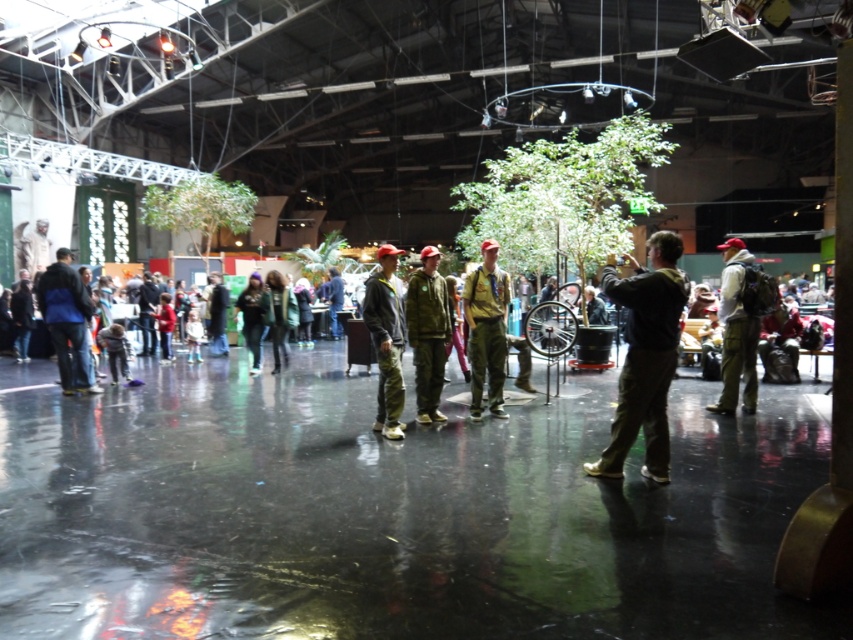
Question: Can you confirm if matte khaki pants at right is positioned to the right of matte green uniform at center?

Choices:
 (A) no
 (B) yes

Answer: (B)

Question: Which object is farther from the camera taking this photo?

Choices:
 (A) camouflage fabric jacket at center
 (B) dark green uniform at center
 (C) matte green uniform at center
 (D) blue jacket at left

Answer: (D)

Question: Observing the image, what is the correct spatial positioning of camouflage fabric jacket at center in reference to camo pants at center?

Choices:
 (A) left
 (B) right

Answer: (B)

Question: Does matte green uniform at center appear on the right side of camo pants at center?

Choices:
 (A) no
 (B) yes

Answer: (B)

Question: Which point appears closest to the camera in this image?

Choices:
 (A) (416, 337)
 (B) (49, 324)
 (C) (676, 298)
 (D) (494, 278)

Answer: (C)

Question: Estimate the real-world distances between objects in this image. Which object is closer to the dark green uniform at center?

Choices:
 (A) camo pants at center
 (B) matte khaki pants at right

Answer: (A)